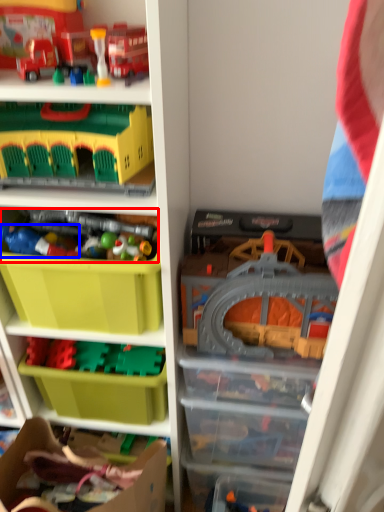
Question: Which point is further to the camera, toy (highlighted by a red box) or toy (highlighted by a blue box)?

Choices:
 (A) toy
 (B) toy

Answer: (A)